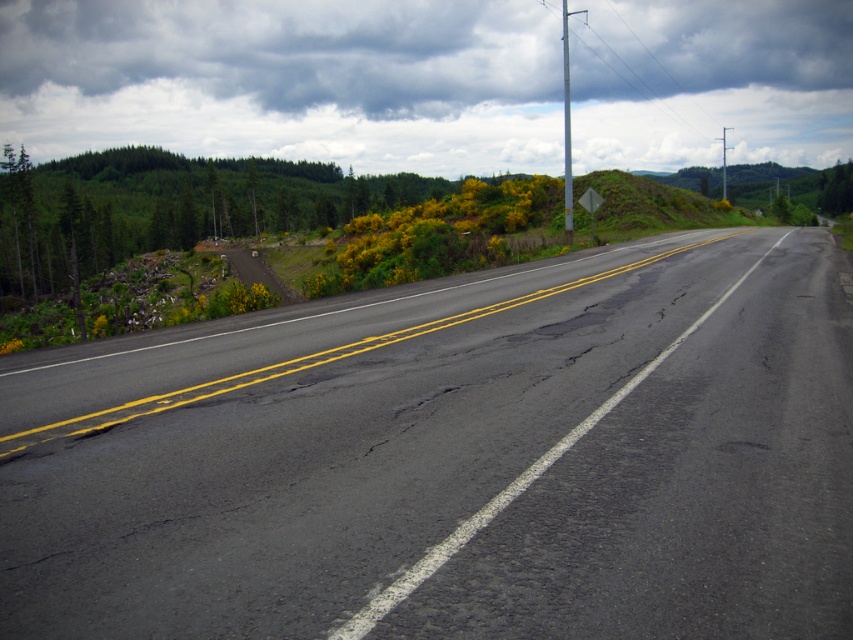
Is point (709, 262) farther from viewer compared to point (807, 48)?

No, (709, 262) is closer to viewer.

Measure the distance between point (657, 561) and camera.

The distance of point (657, 561) from camera is 5.00 meters.

You are a GUI agent. You are given a task and a screenshot of the screen. Output one action in this format:
    pyautogui.click(x=<x>, y=<y>)
    Task: Click on the black asphalt road at center
    
    Given the screenshot: What is the action you would take?
    pyautogui.click(x=451, y=458)